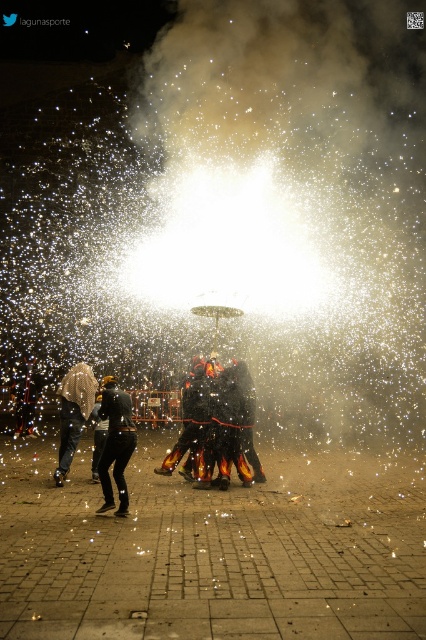
Question: Does black matte pants at lower left have a greater width compared to fuzzy white hair at lower left?

Choices:
 (A) no
 (B) yes

Answer: (B)

Question: Which point appears farthest from the camera in this image?

Choices:
 (A) (108, 380)
 (B) (245, 456)
 (C) (68, 440)

Answer: (B)

Question: Does black matte pants at lower left come behind fuzzy white hair at lower left?

Choices:
 (A) yes
 (B) no

Answer: (B)

Question: Considering the real-world distances, which object is farthest from the black matte/charred figure at center?

Choices:
 (A) black matte pants at lower left
 (B) fuzzy white hair at lower left

Answer: (B)

Question: Which of the following is the farthest from the observer?

Choices:
 (A) black matte pants at lower left
 (B) fuzzy white hair at lower left
 (C) black matte/charred figure at center

Answer: (B)

Question: Can you confirm if black matte pants at lower left is positioned above fuzzy white hair at lower left?

Choices:
 (A) yes
 (B) no

Answer: (A)